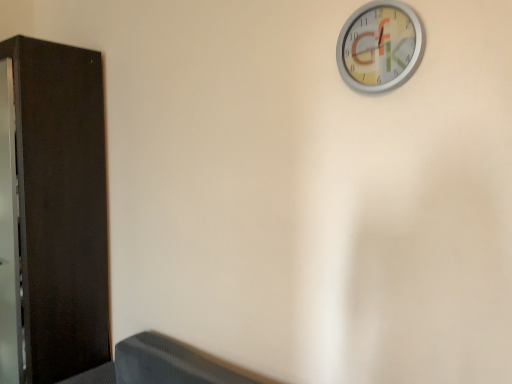
Question: From the image's perspective, is dark wood dresser at left located above metallic silver clock at upper right?

Choices:
 (A) yes
 (B) no

Answer: (B)

Question: Does dark wood dresser at left have a lesser height compared to metallic silver clock at upper right?

Choices:
 (A) yes
 (B) no

Answer: (B)

Question: From a real-world perspective, is dark wood dresser at left located beneath metallic silver clock at upper right?

Choices:
 (A) no
 (B) yes

Answer: (B)

Question: Is dark wood dresser at left positioned with its back to metallic silver clock at upper right?

Choices:
 (A) yes
 (B) no

Answer: (B)

Question: Can we say dark wood dresser at left lies outside metallic silver clock at upper right?

Choices:
 (A) no
 (B) yes

Answer: (B)

Question: Is the depth of dark wood dresser at left less than that of metallic silver clock at upper right?

Choices:
 (A) no
 (B) yes

Answer: (A)

Question: Could dark wood dresser at left be considered to be inside metallic silver clock at upper right?

Choices:
 (A) no
 (B) yes

Answer: (A)

Question: From a real-world perspective, is metallic silver clock at upper right physically above dark wood dresser at left?

Choices:
 (A) yes
 (B) no

Answer: (A)

Question: Is metallic silver clock at upper right turned away from dark wood dresser at left?

Choices:
 (A) yes
 (B) no

Answer: (B)

Question: Does metallic silver clock at upper right turn towards dark wood dresser at left?

Choices:
 (A) no
 (B) yes

Answer: (A)

Question: From the image's perspective, does metallic silver clock at upper right appear higher than dark wood dresser at left?

Choices:
 (A) yes
 (B) no

Answer: (A)

Question: Does metallic silver clock at upper right lie behind dark wood dresser at left?

Choices:
 (A) yes
 (B) no

Answer: (B)

Question: From the image's perspective, relative to metallic silver clock at upper right, is dark wood dresser at left above or below?

Choices:
 (A) below
 (B) above

Answer: (A)